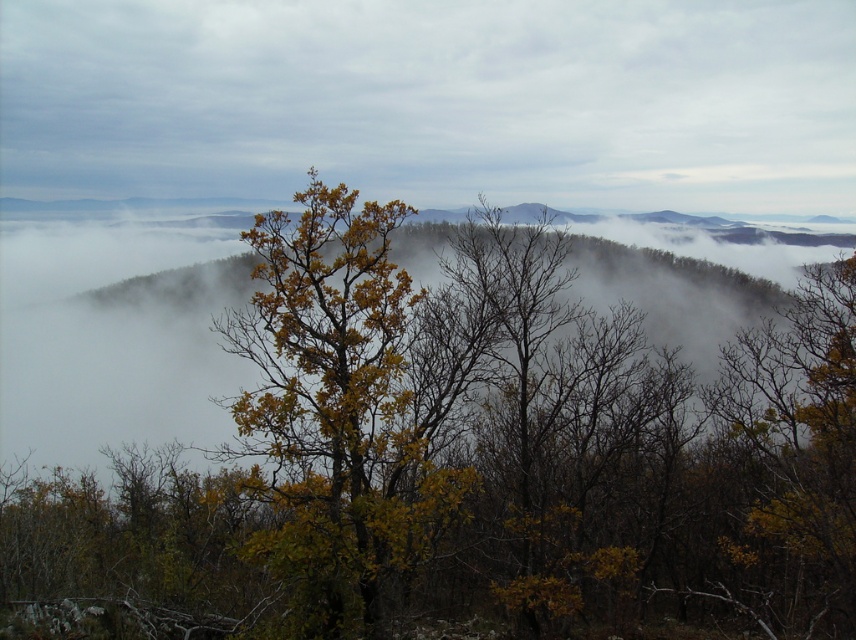
Question: Among these objects, which one is farthest from the camera?

Choices:
 (A) white fog at upper center
 (B) yellow-green leaves at center
 (C) yellow-green leafy tree at center

Answer: (A)

Question: Is white fog at upper center below yellow-green leafy tree at center?

Choices:
 (A) yes
 (B) no

Answer: (B)

Question: Which point appears farthest from the camera in this image?

Choices:
 (A) coord(770,412)
 (B) coord(324,452)
 (C) coord(134,152)

Answer: (C)

Question: Can you confirm if yellow-green leaves at center is smaller than yellow-green leafy tree at center?

Choices:
 (A) no
 (B) yes

Answer: (A)

Question: Considering the real-world distances, which object is farthest from the yellow-green leaves at center?

Choices:
 (A) yellow-green leafy tree at center
 (B) white fog at upper center

Answer: (B)

Question: Is yellow-green leaves at center thinner than yellow-green leafy tree at center?

Choices:
 (A) no
 (B) yes

Answer: (A)